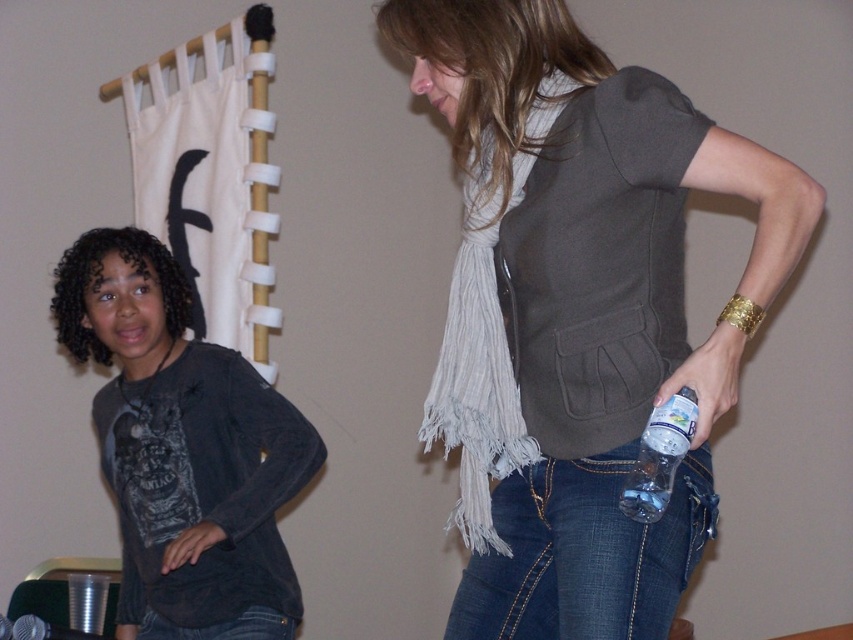
Does matte gray scarf at center lie in front of dark gray cotton shirt at center?

That is True.

In the scene shown: Is matte gray scarf at center wider than dark gray cotton shirt at center?

No, matte gray scarf at center is not wider than dark gray cotton shirt at center.

Between point (621, 586) and point (189, 305), which one is positioned in front?

Point (621, 586) is in front.

The image size is (853, 640). I want to click on matte gray scarf at center, so 592,305.

Does matte gray scarf at center have a larger size compared to denim at right?

Yes.

Between matte gray scarf at center and denim at right, which one is positioned higher?

matte gray scarf at center

What do you see at coordinates (592, 305) in the screenshot? This screenshot has width=853, height=640. I see `matte gray scarf at center` at bounding box center [592, 305].

Identify the location of matte gray scarf at center. This screenshot has height=640, width=853. (592, 305).

Is matte gray scarf at center to the left of jeans at lower center from the viewer's perspective?

Incorrect, matte gray scarf at center is not on the left side of jeans at lower center.

This screenshot has height=640, width=853. What do you see at coordinates (592, 305) in the screenshot?
I see `matte gray scarf at center` at bounding box center [592, 305].

The width and height of the screenshot is (853, 640). Find the location of `matte gray scarf at center`. matte gray scarf at center is located at coordinates (592, 305).